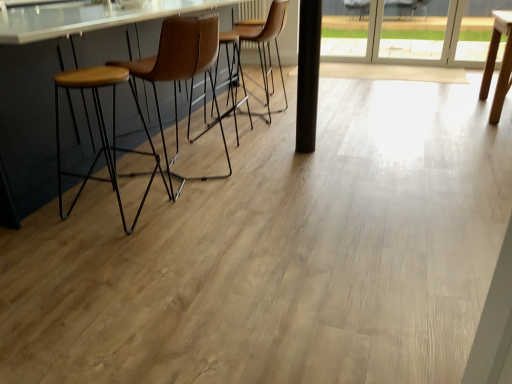
This screenshot has width=512, height=384. Find the location of `free area in between wooden seat stool at left and brown leather stool at left, the second chair viewed from the back`. free area in between wooden seat stool at left and brown leather stool at left, the second chair viewed from the back is located at coordinates (157, 201).